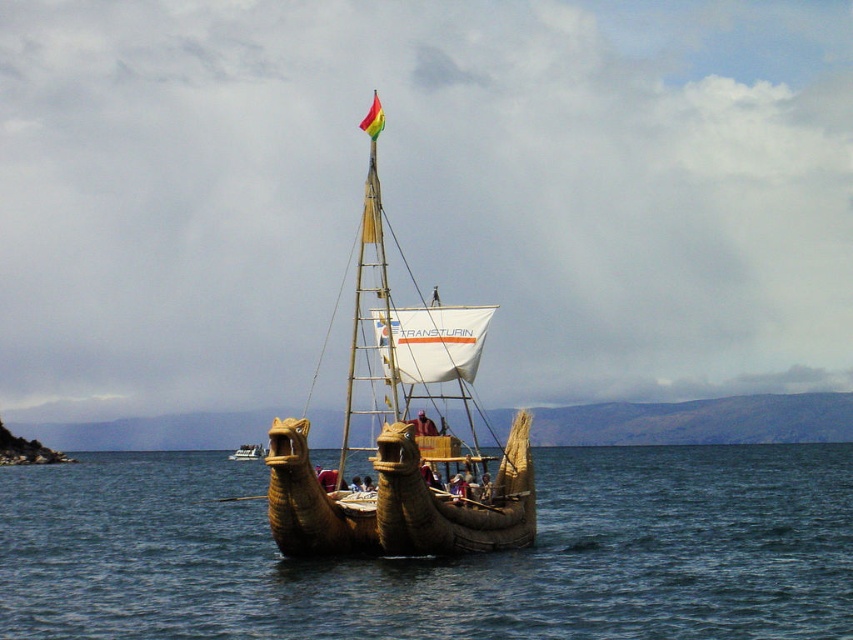
Based on the photo, you are a tourist on the Uros boat and want to take a photo that includes both the natural wood boat at center and the rainbow fabric flag at top center. Considering their sizes, which object should you ensure is closer to the camera to include both in the frame?

The natural wood boat at center has a smaller size compared to rainbow fabric flag at top center. To include both in the frame, you should position yourself closer to the natural wood boat at center so its smaller size appears larger, balancing it with the larger rainbow fabric flag at top center in the background.

You are a tour guide standing on the deck of the Uros boat. You need to inform your tourists about the distance between the brown woven water at center and the rainbow fabric flag at top center. What do you tell them?

The brown woven water at center is 71.12 meters away from the rainbow fabric flag at top center.

You are a tourist on the Uros boat and want to take a photo of the brown woven water at center without the rainbow fabric flag at top center blocking the view. Is this possible?

The brown woven water at center is in front of the rainbow fabric flag at top center, so the flag will block the view of the water. Therefore, it is not possible to take a photo of the brown woven water at center without the rainbow fabric flag at top center blocking the view.